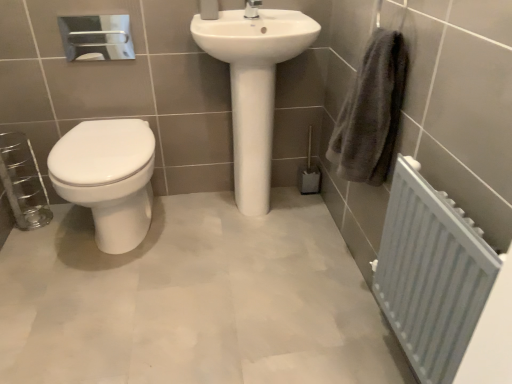
You are a GUI agent. You are given a task and a screenshot of the screen. Output one action in this format:
    pyautogui.click(x=<x>, y=<y>)
    Task: Click on the free spot to the right of white glossy toilet at left
    The width and height of the screenshot is (512, 384).
    Given the screenshot: What is the action you would take?
    pyautogui.click(x=212, y=252)